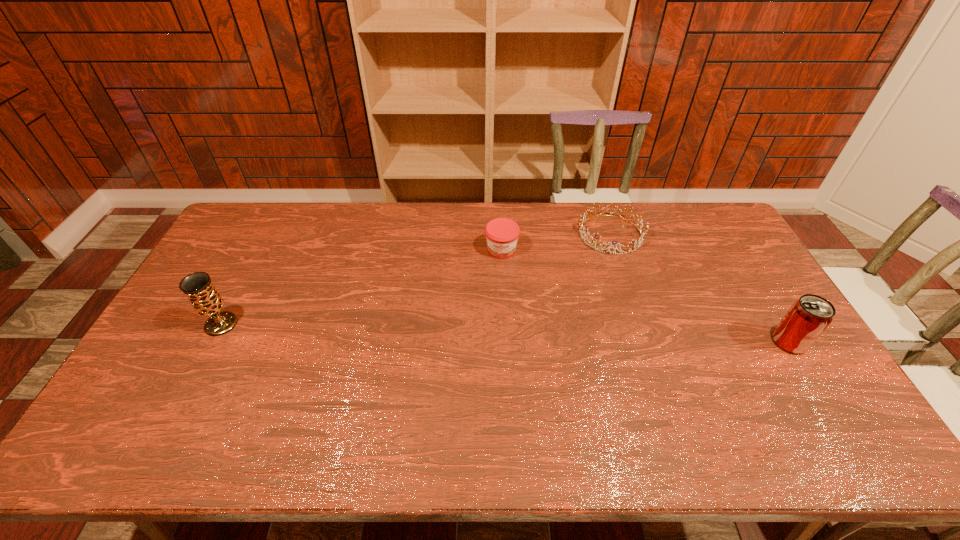
In the image, there is a desktop. Where is `blank space at the near edge`? This screenshot has width=960, height=540. blank space at the near edge is located at coordinates (210, 401).

Where is `vacant area at the left edge of the desktop`? This screenshot has width=960, height=540. vacant area at the left edge of the desktop is located at coordinates (154, 381).

I want to click on free region at the far right corner of the desktop, so click(x=707, y=210).

Locate an element on the screen. vacant area between the shortest object and the second tallest object is located at coordinates (700, 288).

Find the location of `unoccupied area between the third tallest object and the third shortest object`. unoccupied area between the third tallest object and the third shortest object is located at coordinates (645, 296).

I want to click on free space between the chalice and the shortest object, so click(416, 279).

Image resolution: width=960 pixels, height=540 pixels. I want to click on blank region between the jam and the leftmost object, so click(x=361, y=287).

Locate an element on the screen. The width and height of the screenshot is (960, 540). empty space that is in between the pop soda and the leftmost object is located at coordinates (505, 333).

Identify the location of unoccupied area between the tiara and the chalice. The image size is (960, 540). (416, 279).

At what (x,y) coordinates should I click in order to perform the action: click on free spot between the third object from left to right and the second object from left to right. Please return your answer as a coordinate pair (x, y). Image resolution: width=960 pixels, height=540 pixels. Looking at the image, I should click on (556, 242).